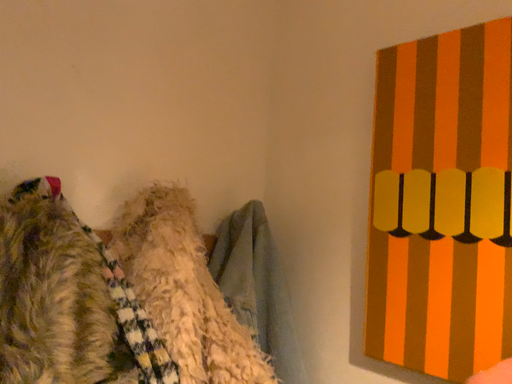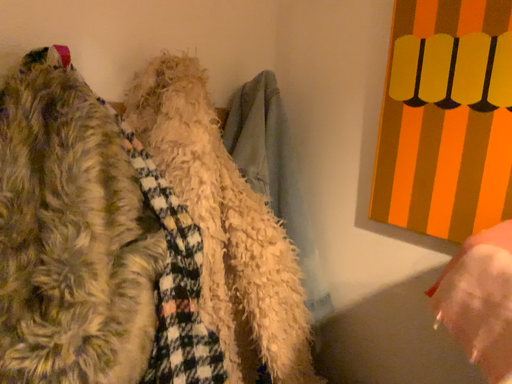
Question: Which way did the camera rotate in the video?

Choices:
 (A) rotated downward
 (B) rotated upward

Answer: (A)